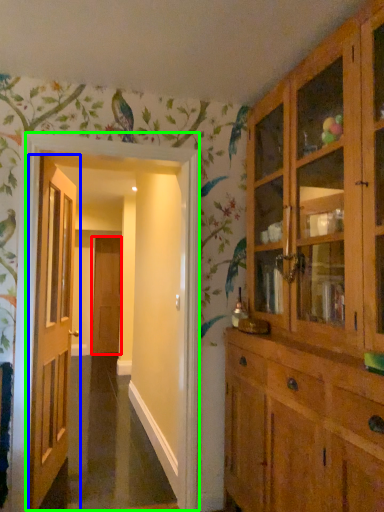
Question: Which object is the farthest from door (highlighted by a red box)? Choose among these: door (highlighted by a blue box) or corridor (highlighted by a green box).

Choices:
 (A) door
 (B) corridor

Answer: (B)